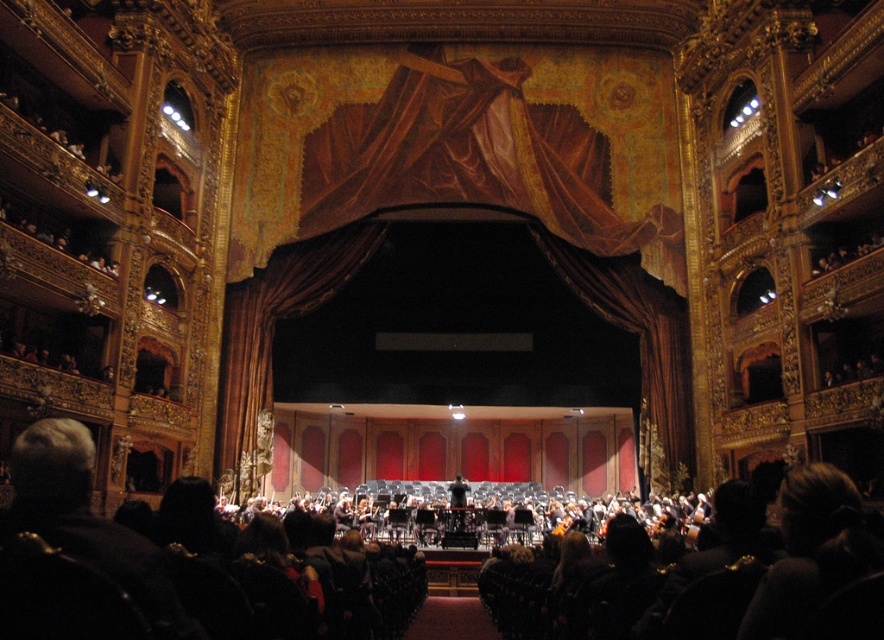
You are a stagehand standing at the back of the opera house and need to adjust the velvet drapery at center and the black smooth conductor at center. Which object is positioned to the left of the other?

The velvet drapery at center is to the left of the black smooth conductor at center.

You are a stagehand who needs to ensure that the velvet drapery at center and the black smooth conductor at center are visible to the audience. Given their sizes, which object might require adjustment to avoid blocking the view?

The velvet drapery at center is bigger than the black smooth conductor at center, so the velvet drapery at center might need adjustment to ensure it doesn not block the conductor or the audience view.

You are an usher at the opera house and need to guide a guest to the stage. The guest asks if they can walk through the space between the velvet drapery at center and the black smooth conductor at center. Based on the scene, can they pass through comfortably?

The velvet drapery at center is wider than the black smooth conductor at center, so there is sufficient space between them for the guest to walk through comfortably.